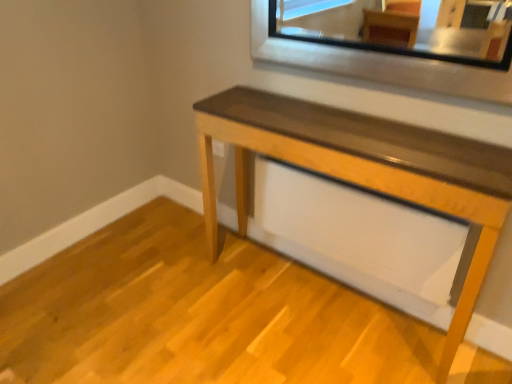
Find the location of a particular element. free point in front of wooden table at lower right is located at coordinates (298, 316).